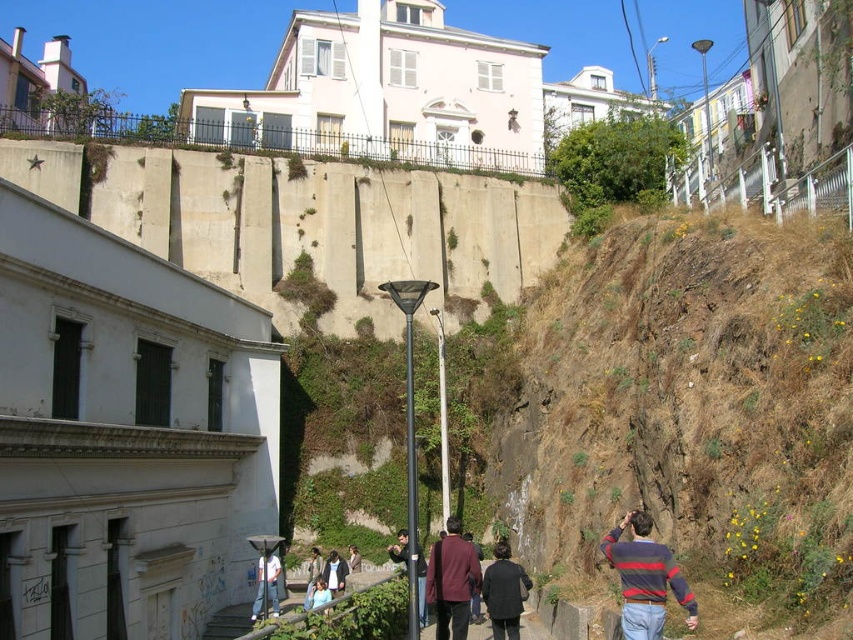
Question: Can you confirm if brown/dry grass hillside at lower right is positioned to the left of maroon fabric coat at center?

Choices:
 (A) yes
 (B) no

Answer: (B)

Question: Which of the following is the farthest from the observer?

Choices:
 (A) dark gray coat at lower right
 (B) light brown leather jacket at center

Answer: (B)

Question: Can you confirm if maroon fabric coat at center is wider than dark blue sweater at center?

Choices:
 (A) no
 (B) yes

Answer: (A)

Question: Is brown/dry grass hillside at lower right to the left of light blue shirt at center from the viewer's perspective?

Choices:
 (A) no
 (B) yes

Answer: (A)

Question: Which of the following is the farthest from the observer?

Choices:
 (A) dark blue denim jacket at lower center
 (B) light blue shirt at center

Answer: (A)

Question: Estimate the real-world distances between objects in this image. Which object is closer to the dark gray coat at lower right?

Choices:
 (A) white cotton shirt at lower center
 (B) striped sweater at lower right
 (C) smooth concrete stairs at lower center
 (D) brown/dry grass hillside at lower right

Answer: (C)